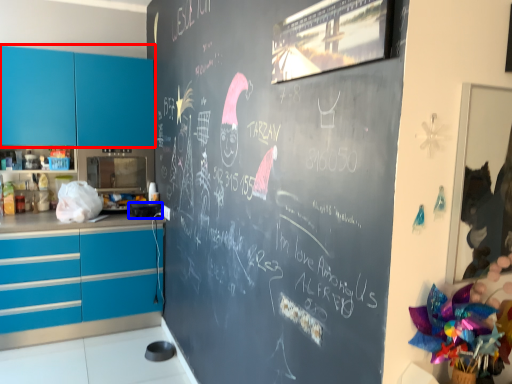
Question: Which point is closer to the camera, cabinetry (highlighted by a red box) or appliance (highlighted by a blue box)?

Choices:
 (A) cabinetry
 (B) appliance

Answer: (A)